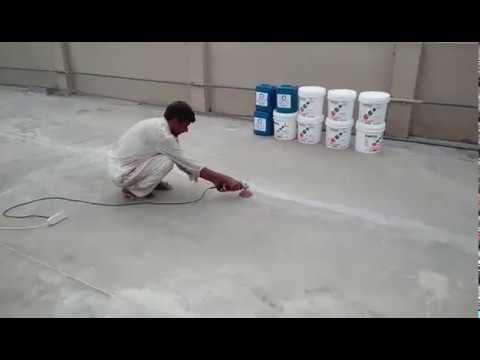
This screenshot has width=480, height=360. Identify the location of grey painted wall. (300, 62).